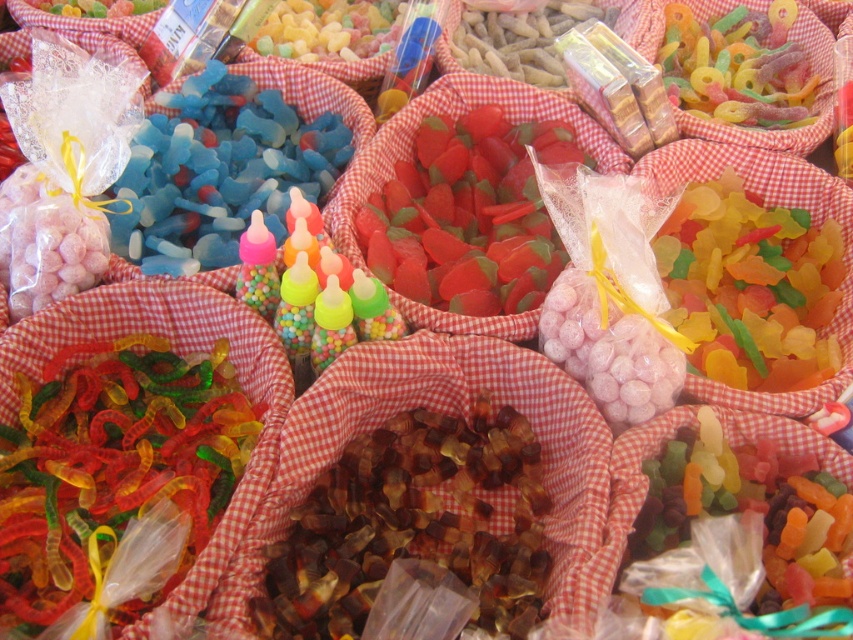
Question: Can you confirm if translucent amber gummy bears at center is wider than translucent red gummy at center?

Choices:
 (A) no
 (B) yes

Answer: (A)

Question: Estimate the real-world distances between objects in this image. Which object is farther from the translucent amber gummy bears at center?

Choices:
 (A) translucent red gummy at center
 (B) blue translucent gummy bears at upper left

Answer: (B)

Question: Can you confirm if translucent red gummy at center is positioned to the left of blue translucent gummy bears at upper left?

Choices:
 (A) no
 (B) yes

Answer: (A)

Question: Can you confirm if translucent amber gummy bears at center is positioned to the right of translucent red gummy at center?

Choices:
 (A) yes
 (B) no

Answer: (B)

Question: Which of the following is the closest to the observer?

Choices:
 (A) (260, 150)
 (B) (514, 224)
 (C) (283, 540)

Answer: (C)

Question: Which object is the closest to the translucent red gummy at center?

Choices:
 (A) blue translucent gummy bears at upper left
 (B) translucent amber gummy bears at center

Answer: (A)